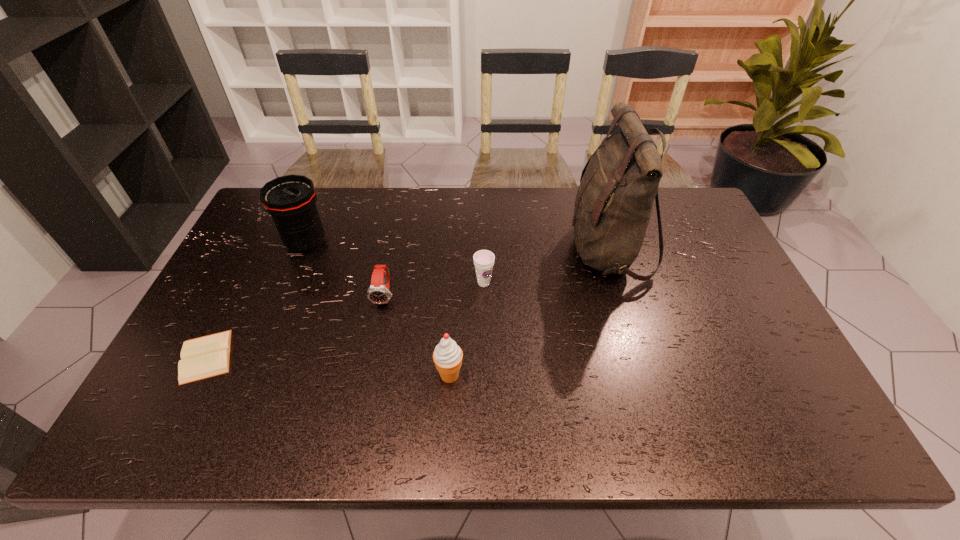
At what (x,y) coordinates should I click in order to perform the action: click on object located at the far left corner. Please return your answer as a coordinate pair (x, y). The image size is (960, 540). Looking at the image, I should click on (291, 200).

In the image, there is a desktop. Where is `vacant space at the far edge`? vacant space at the far edge is located at coordinates coord(467,224).

At what (x,y) coordinates should I click in order to perform the action: click on free space at the near edge. Please return your answer as a coordinate pair (x, y). The height and width of the screenshot is (540, 960). Looking at the image, I should click on (360, 430).

In the image, there is a desktop. Identify the location of vacant region at the left edge. The height and width of the screenshot is (540, 960). (230, 322).

Where is `free space at the far right corner of the desktop`? The width and height of the screenshot is (960, 540). free space at the far right corner of the desktop is located at coordinates (662, 220).

Image resolution: width=960 pixels, height=540 pixels. What are the coordinates of `vacant area between the third object from left to right and the shortest object` in the screenshot? It's located at (296, 326).

This screenshot has width=960, height=540. In order to click on unoccupied position between the second object from right to left and the fourth object from left to right in this screenshot , I will do `click(467, 329)`.

Locate an element on the screen. The height and width of the screenshot is (540, 960). free space between the shortest object and the fourth object from right to left is located at coordinates (296, 326).

I want to click on unoccupied area between the fourth object from right to left and the shortest object, so click(296, 326).

This screenshot has height=540, width=960. I want to click on free point between the telephoto lens and the watch, so click(346, 269).